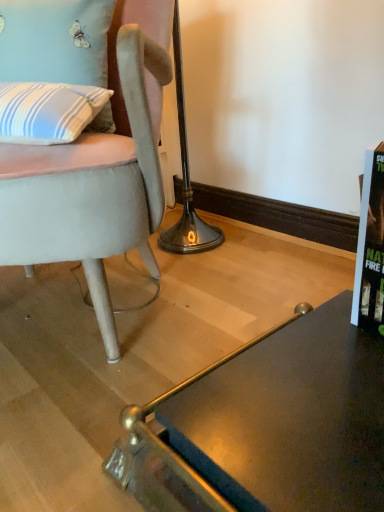
Question: Visually, is blue striped fabric pillow at upper left positioned to the left or to the right of glassy dark brown desk at lower right?

Choices:
 (A) right
 (B) left

Answer: (B)

Question: From the image's perspective, is blue striped fabric pillow at upper left positioned above or below glassy dark brown desk at lower right?

Choices:
 (A) above
 (B) below

Answer: (A)

Question: Which is nearer to the suede-like gray chair at left?

Choices:
 (A) blue striped fabric pillow at upper left
 (B) glassy dark brown desk at lower right

Answer: (A)

Question: Estimate the real-world distances between objects in this image. Which object is closer to the suede-like gray chair at left?

Choices:
 (A) blue striped fabric pillow at upper left
 (B) glassy dark brown desk at lower right

Answer: (A)